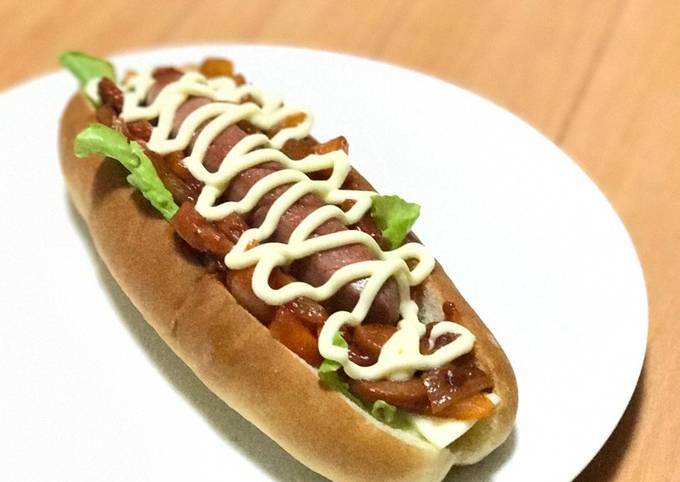
Where is `plate`? The image size is (680, 482). plate is located at coordinates (x=85, y=396).